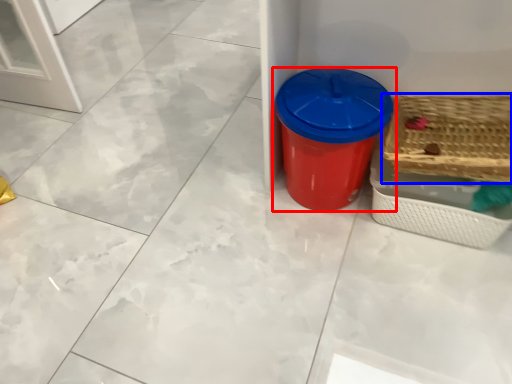
Question: Which point is closer to the camera, waste container (highlighted by a red box) or basket (highlighted by a blue box)?

Choices:
 (A) waste container
 (B) basket

Answer: (B)